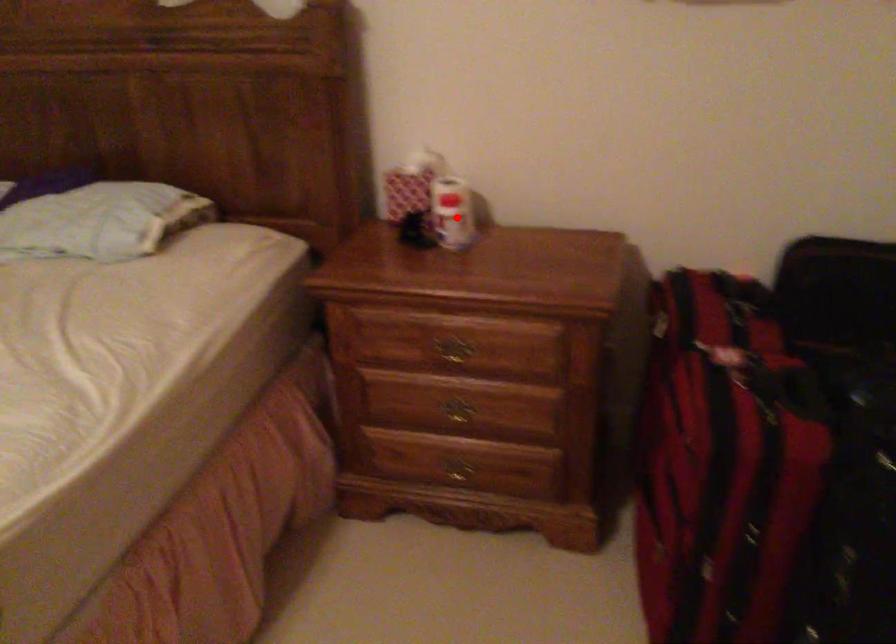
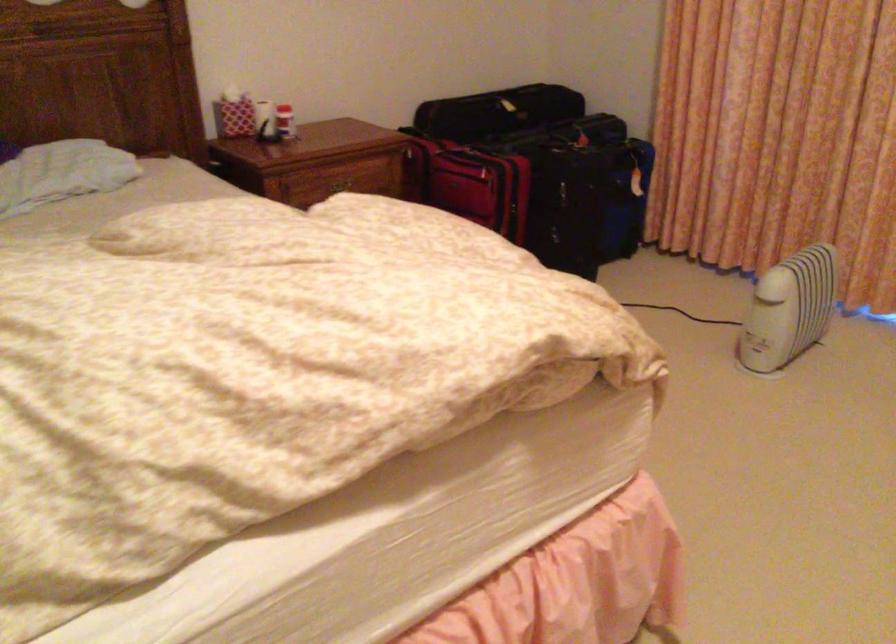
The point at the highlighted location is marked in the first image. Where is the corresponding point in the second image?

(285, 122)